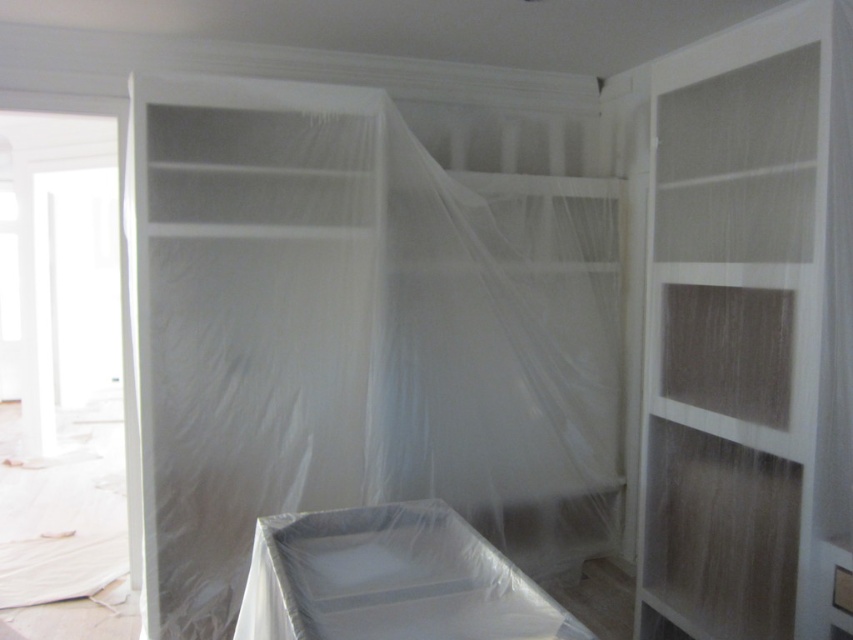
Question: Can you confirm if transparent plastic curtain at center is thinner than white matte wood shelf at center?

Choices:
 (A) yes
 (B) no

Answer: (B)

Question: Among these points, which one is farthest from the camera?

Choices:
 (A) (287, 344)
 (B) (757, 592)

Answer: (A)

Question: Among these points, which one is nearest to the camera?

Choices:
 (A) (735, 394)
 (B) (479, 483)

Answer: (A)

Question: Can you confirm if transparent plastic curtain at center is positioned below white matte wood shelf at center?

Choices:
 (A) no
 (B) yes

Answer: (B)

Question: Which of the following is the farthest from the observer?

Choices:
 (A) transparent plastic curtain at center
 (B) white matte wood shelf at center

Answer: (A)

Question: Observing the image, what is the correct spatial positioning of transparent plastic curtain at center in reference to white matte wood shelf at center?

Choices:
 (A) right
 (B) left

Answer: (B)